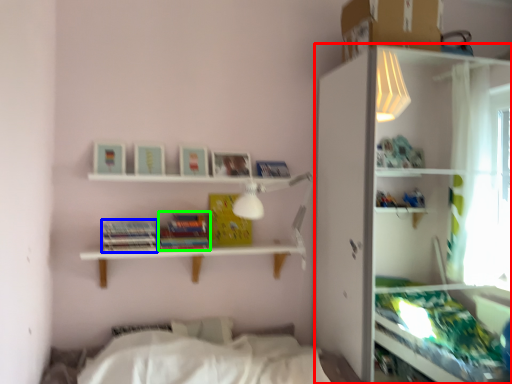
Question: Based on their relative distances, which object is nearer to shelf (highlighted by a red box)? Choose from paperback book (highlighted by a blue box) and paperback book (highlighted by a green box).

Choices:
 (A) paperback book
 (B) paperback book

Answer: (B)